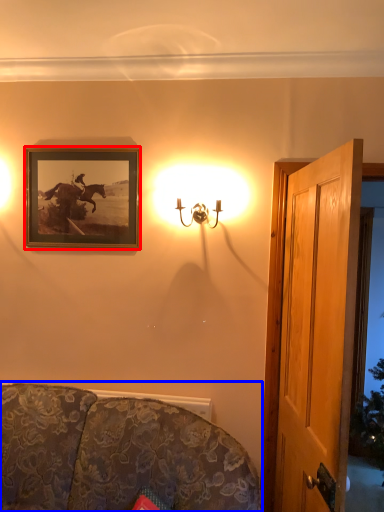
Question: Which of the following is the closest to the observer, picture frame (highlighted by a red box) or studio couch (highlighted by a blue box)?

Choices:
 (A) picture frame
 (B) studio couch

Answer: (B)